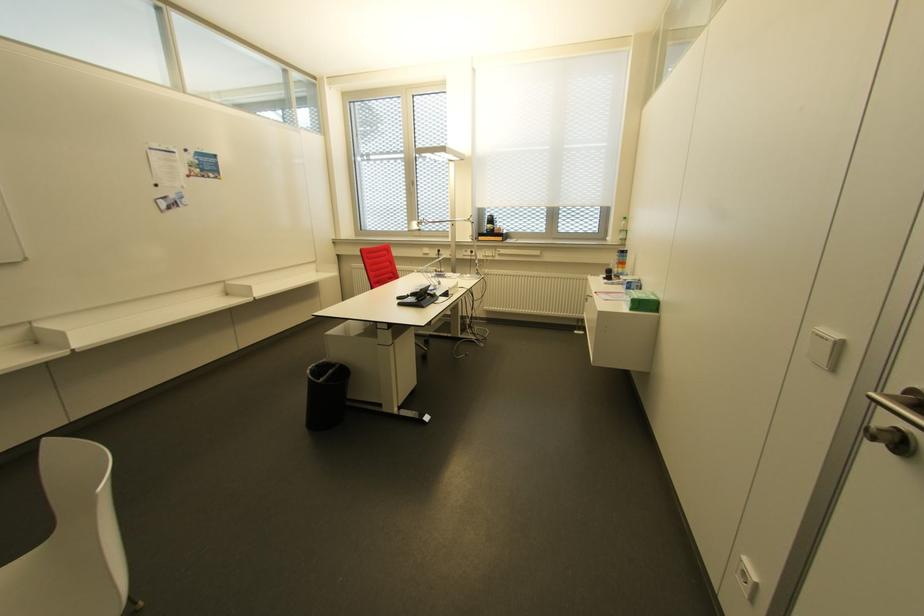
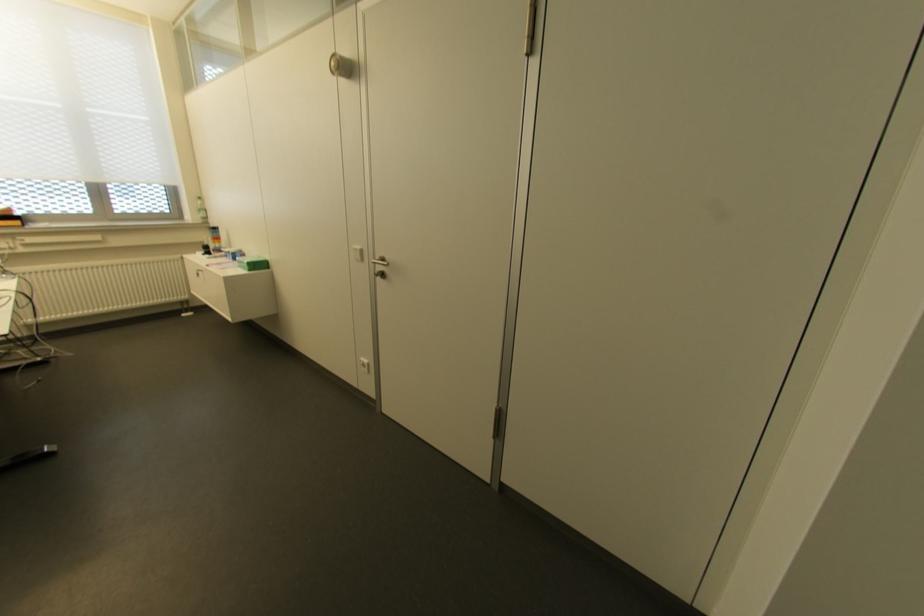
Where in the second image is the point corresponding to pixel 629 310 from the first image?

(248, 270)